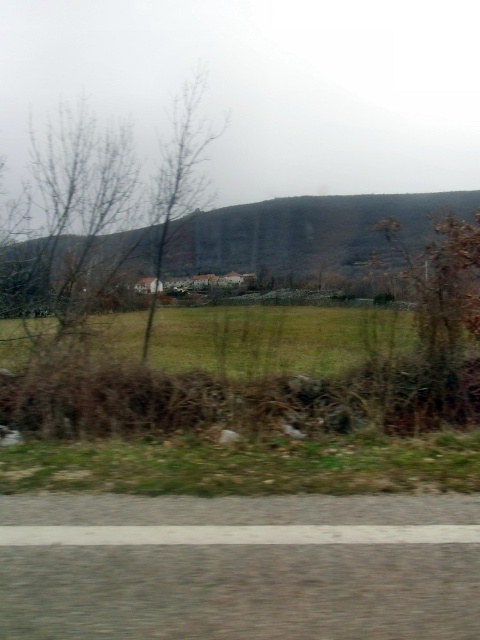
Which is behind, point (84, 280) or point (367, 307)?

The point (367, 307) is behind.

Find the location of a particular element. bare branches at left is located at coordinates (110, 196).

This screenshot has width=480, height=640. Find the location of `bare branches at left`. bare branches at left is located at coordinates (110, 196).